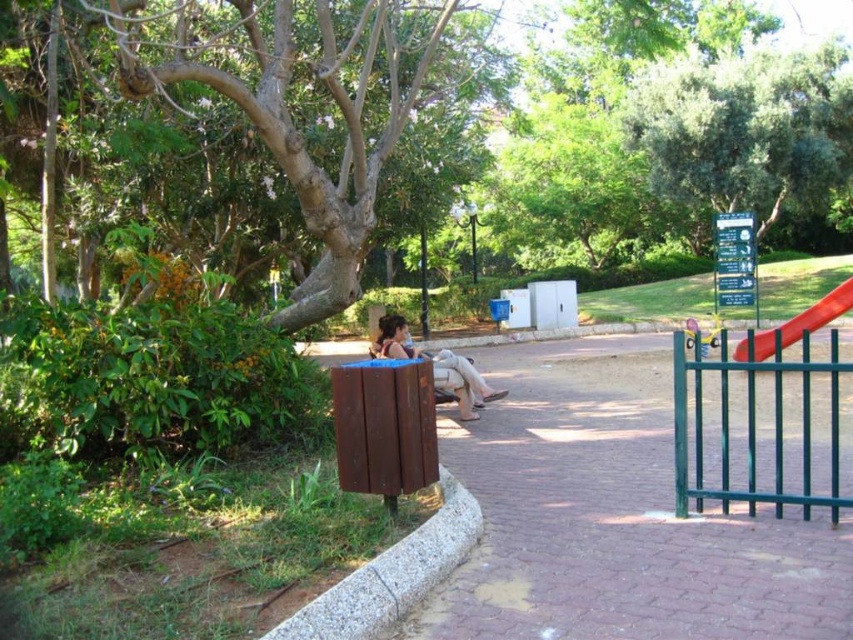
You are a parent watching your child play in the park. You see the green leafy tree at upper center and the rubber smooth slide at right. Which object is higher up in the image?

The green leafy tree at upper center is above the rubber smooth slide at right, so it is higher up in the image.

You are a parent watching your child play in the park. You see the green leafy tree at upper center and the rubber smooth slide at right. Which object is wider from your viewpoint?

The green leafy tree at upper center might be wider than the rubber smooth slide at right according to the description.